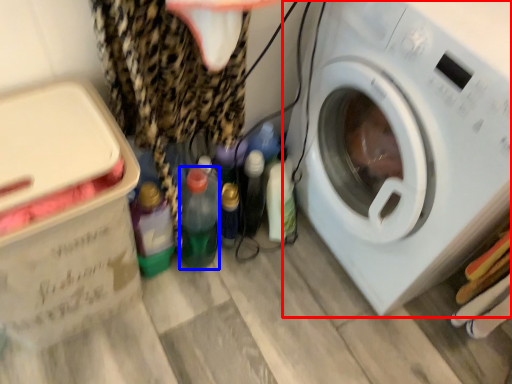
Question: Among these objects, which one is nearest to the camera, washing machine (highlighted by a red box) or bottle (highlighted by a blue box)?

Choices:
 (A) washing machine
 (B) bottle

Answer: (A)